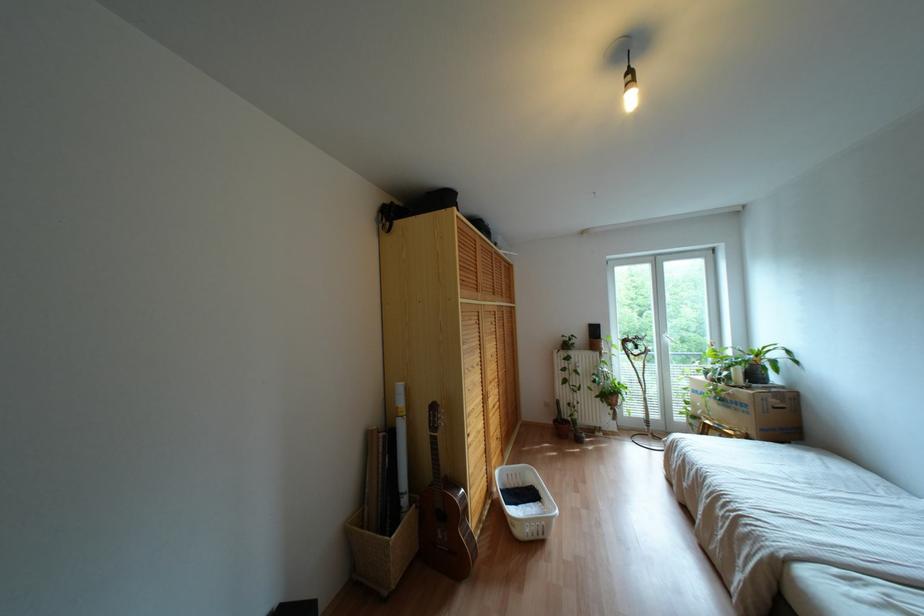
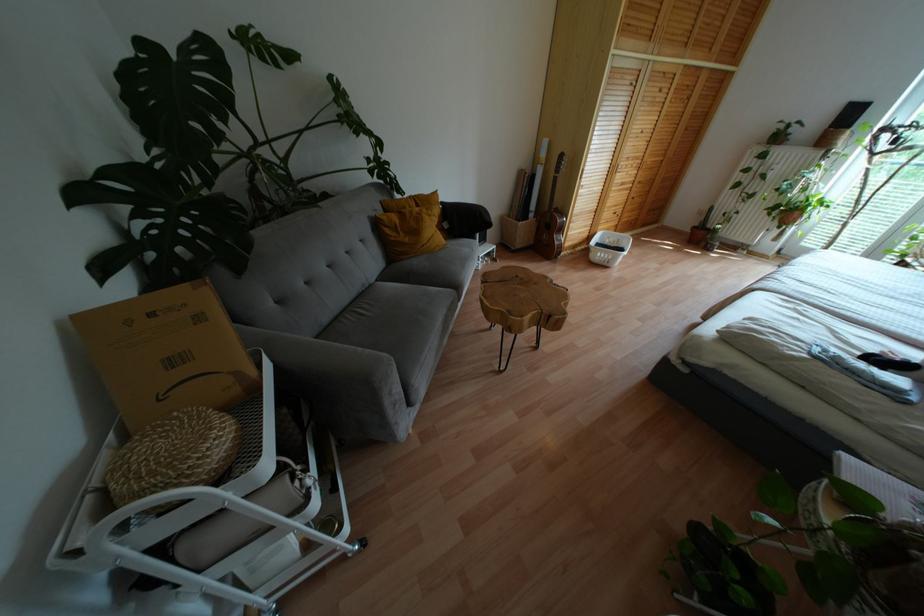
Locate, in the second image, the point that corresponds to (553,421) in the first image.

(694, 227)